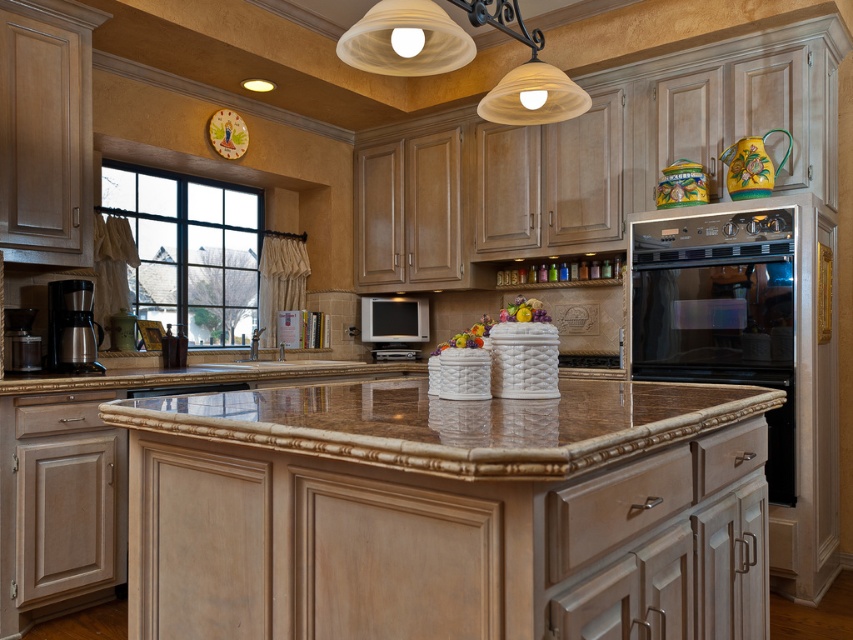
Is brown granite countertop at center below satin silver oven at right?

Indeed, brown granite countertop at center is positioned under satin silver oven at right.

Can you confirm if brown granite countertop at center is thinner than satin silver oven at right?

No, brown granite countertop at center is not thinner than satin silver oven at right.

This screenshot has height=640, width=853. Find the location of `brown granite countertop at center`. brown granite countertop at center is located at coordinates (461, 422).

What do you see at coordinates (461, 422) in the screenshot? This screenshot has width=853, height=640. I see `brown granite countertop at center` at bounding box center [461, 422].

Who is shorter, brown granite countertop at center or satin silver coffee maker at left?

brown granite countertop at center

This screenshot has width=853, height=640. Identify the location of brown granite countertop at center. (461, 422).

Which of these two, satin silver oven at right or satin silver coffee maker at left, stands shorter?

satin silver coffee maker at left is shorter.

Find the location of a particular element. This screenshot has width=853, height=640. satin silver oven at right is located at coordinates (720, 312).

Is point (672, 227) farther from viewer compared to point (67, 280)?

Yes, it is.

Where is `satin silver oven at right`? satin silver oven at right is located at coordinates (720, 312).